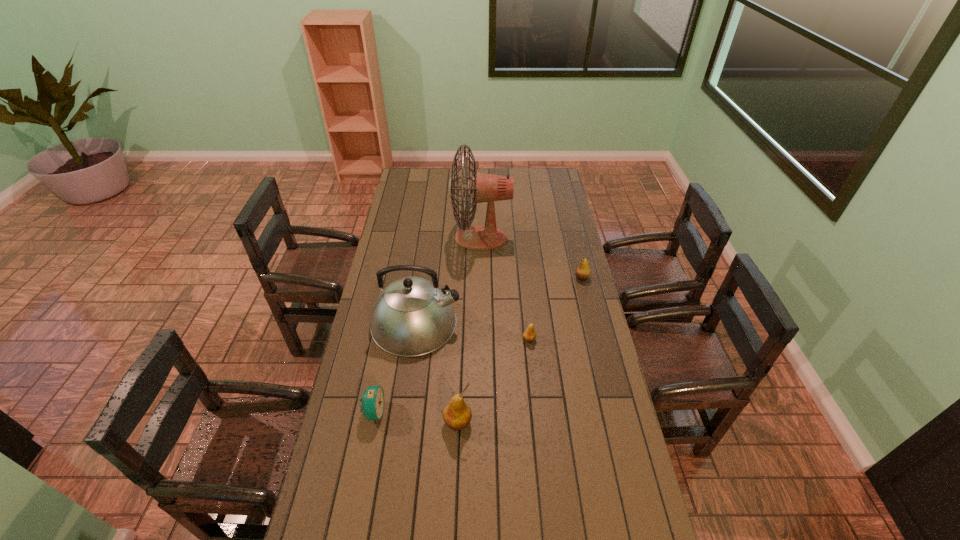
At what (x,y) coordinates should I click in order to perform the action: click on object that is at the right edge. Please return your answer as a coordinate pair (x, y). Looking at the image, I should click on (583, 271).

Locate an element on the screen. This screenshot has width=960, height=540. vacant space at the far edge of the desktop is located at coordinates (470, 176).

In the image, there is a desktop. At what (x,y) coordinates should I click in order to perform the action: click on free region at the near edge. Please return your answer as a coordinate pair (x, y). This screenshot has height=540, width=960. Looking at the image, I should click on (521, 526).

In the image, there is a desktop. Where is `vacant space at the left edge`? vacant space at the left edge is located at coordinates (394, 226).

In order to click on free spot at the right edge of the desktop in this screenshot , I will do `click(586, 328)`.

In the image, there is a desktop. Find the location of `free space at the far left corner`. free space at the far left corner is located at coordinates (405, 175).

Find the location of a particular element. free space between the alarm clock and the fourth tallest object is located at coordinates (478, 345).

You are a GUI agent. You are given a task and a screenshot of the screen. Output one action in this format:
    pyautogui.click(x=<x>, y=<y>)
    Task: Click on the unoccupied position between the second farthest object and the second farthest pear
    This screenshot has width=960, height=540.
    Given the screenshot: What is the action you would take?
    point(556,309)

Identify the location of vacant point located between the fifth shortest object and the second shortest pear. The height and width of the screenshot is (540, 960). coord(499,300).

The height and width of the screenshot is (540, 960). In order to click on unoccupied area between the kettle and the second shortest pear in this screenshot , I will do `click(499, 300)`.